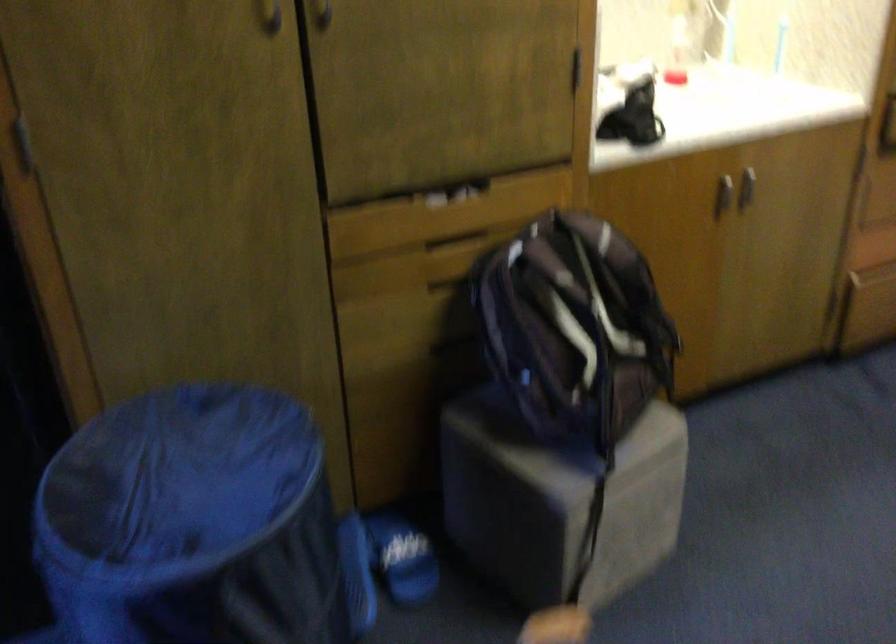
What do you see at coordinates (455, 242) in the screenshot? The width and height of the screenshot is (896, 644). I see `the recessed drawer handle` at bounding box center [455, 242].